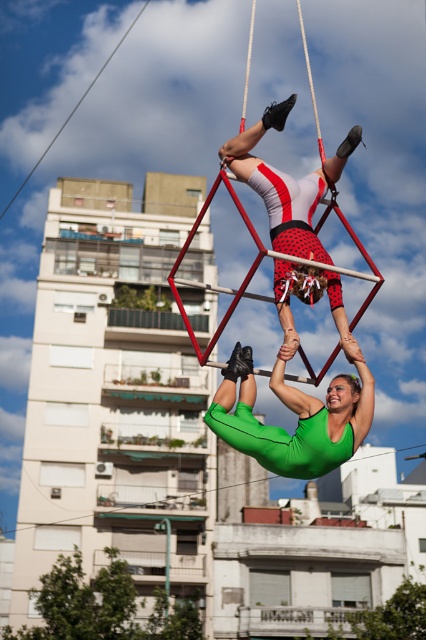
Question: Is green matte leotard at center smaller than matte red and white leotard at center?

Choices:
 (A) no
 (B) yes

Answer: (B)

Question: Among these objects, which one is nearest to the camera?

Choices:
 (A) matte red and white leotard at center
 (B) metallic red swing at center

Answer: (B)

Question: Is matte red and white leotard at center behind metallic red swing at center?

Choices:
 (A) no
 (B) yes

Answer: (B)

Question: Which object is positioned closest to the metallic red swing at center?

Choices:
 (A) matte red and white leotard at center
 (B) green matte leotard at center

Answer: (A)

Question: From the image, what is the correct spatial relationship of matte red and white leotard at center in relation to metallic red swing at center?

Choices:
 (A) right
 (B) left

Answer: (B)

Question: Which point is farther from the camera taking this photo?

Choices:
 (A) (206, 358)
 (B) (302, 230)
 (C) (327, 392)

Answer: (A)